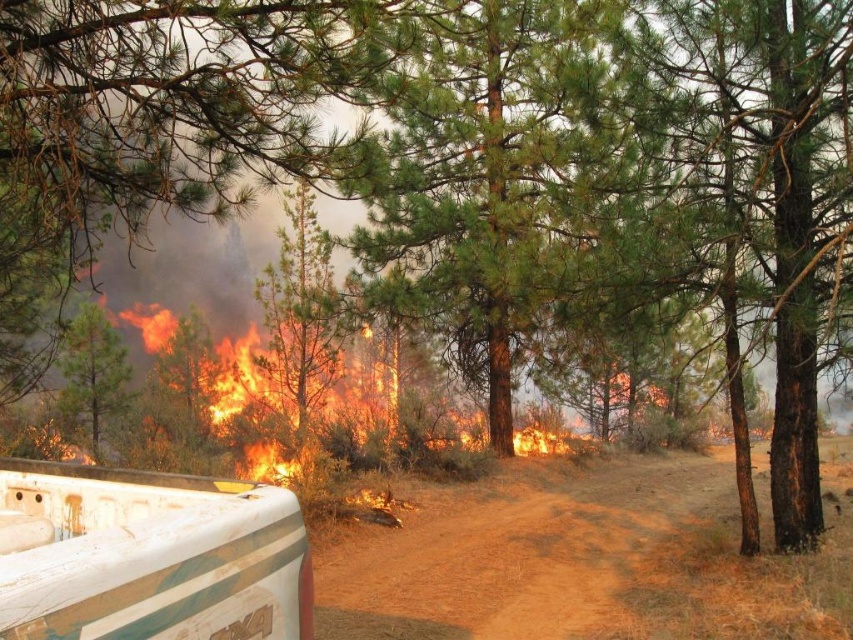
Question: Which of the following is the closest to the observer?

Choices:
 (A) (90, 444)
 (B) (469, 122)

Answer: (A)

Question: Is green pine tree at center bigger than rusty metal truck bed at lower left?

Choices:
 (A) yes
 (B) no

Answer: (A)

Question: Is brown dirt track at center to the left of green pine tree at center from the viewer's perspective?

Choices:
 (A) yes
 (B) no

Answer: (B)

Question: Which point is closer to the camera?

Choices:
 (A) (663, 541)
 (B) (543, 248)
 (C) (64, 340)
 (D) (51, 628)

Answer: (D)

Question: Is brown dirt track at center positioned before green pine tree at center?

Choices:
 (A) yes
 (B) no

Answer: (A)

Question: Which object appears farthest from the camera in this image?

Choices:
 (A) green pine tree at center
 (B) green rough bark tree at upper left

Answer: (B)